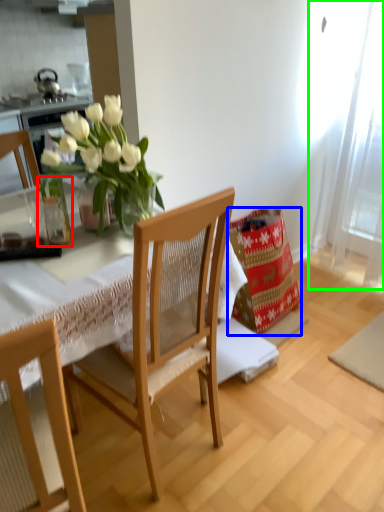
Question: Considering the real-world distances, which object is farthest from glass vase (highlighted by a red box)? material (highlighted by a blue box) or curtain (highlighted by a green box)?

Choices:
 (A) material
 (B) curtain

Answer: (B)